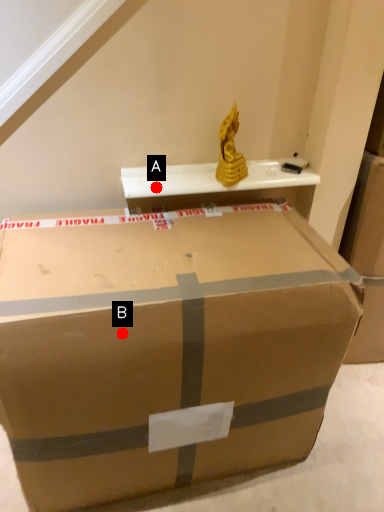
Question: Two points are circled on the image, labeled by A and B beside each circle. Which point is closer to the camera taking this photo?

Choices:
 (A) A is closer
 (B) B is closer

Answer: (B)